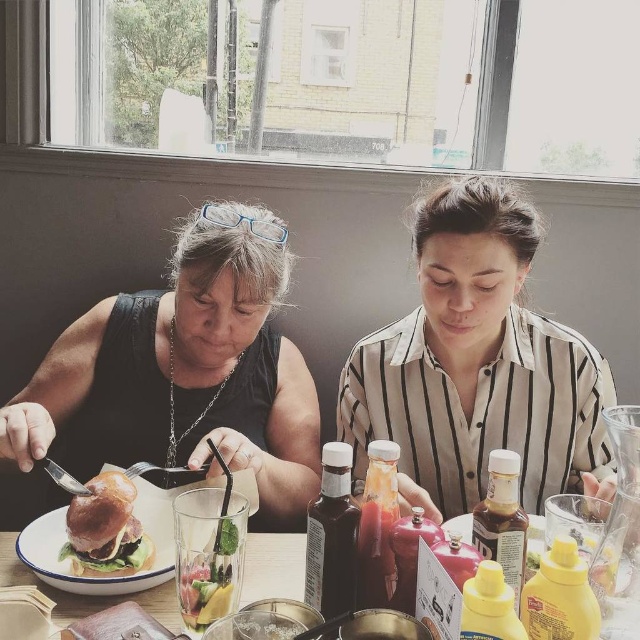
Question: Among these objects, which one is nearest to the camera?

Choices:
 (A) wooden table at center
 (B) white striped shirt at center
 (C) matte black shirt at left
 (D) golden brown bun at center

Answer: (A)

Question: Is matte black shirt at center to the left of matte black shirt at left from the viewer's perspective?

Choices:
 (A) no
 (B) yes

Answer: (A)

Question: Which of these objects is positioned farthest from the wooden table at center?

Choices:
 (A) golden brown bun at center
 (B) matte black shirt at center
 (C) white striped shirt at center

Answer: (C)

Question: Among these objects, which one is farthest from the camera?

Choices:
 (A) white striped shirt at center
 (B) matte black shirt at left
 (C) golden brown bun at center
 (D) matte black shirt at center

Answer: (A)

Question: Observing the image, what is the correct spatial positioning of matte black shirt at center in reference to matte black shirt at left?

Choices:
 (A) below
 (B) above

Answer: (A)

Question: Can you confirm if matte black shirt at left is positioned to the left of wooden table at center?

Choices:
 (A) no
 (B) yes

Answer: (B)